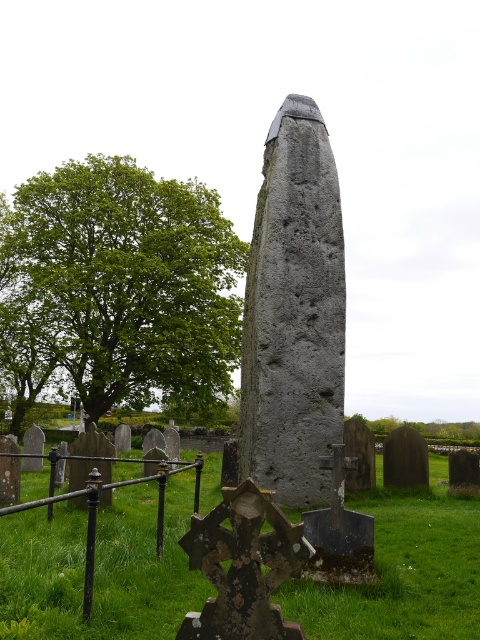
Who is positioned more to the right, green grass at center or green leafy tree at upper left?

green grass at center

Is green grass at center to the right of green leafy tree at upper left from the viewer's perspective?

Indeed, green grass at center is positioned on the right side of green leafy tree at upper left.

Between point (104, 522) and point (52, 243), which one is positioned behind?

Point (52, 243)

Locate an element on the screen. The width and height of the screenshot is (480, 640). green grass at center is located at coordinates (100, 568).